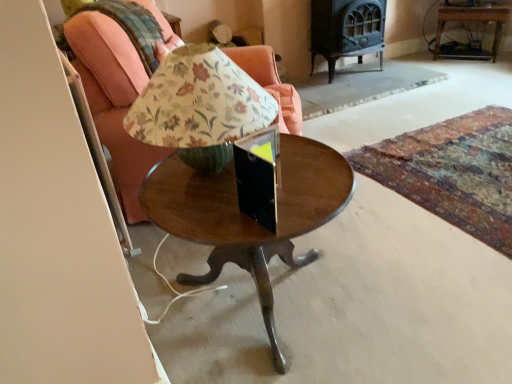
This screenshot has height=384, width=512. I want to click on spots to the right of wooden round table at center, so click(x=408, y=281).